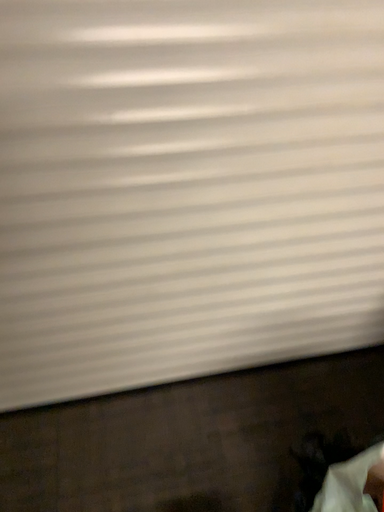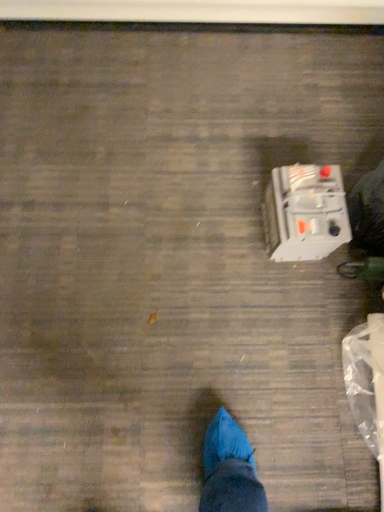
Question: How did the camera likely rotate when shooting the video?

Choices:
 (A) rotated right
 (B) rotated left

Answer: (B)